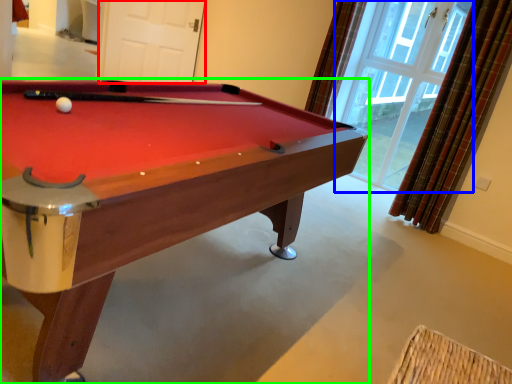
Question: Estimate the real-world distances between objects in this image. Which object is closer to screen door (highlighted by a red box), window (highlighted by a blue box) or billiard table (highlighted by a green box)?

Choices:
 (A) window
 (B) billiard table

Answer: (A)